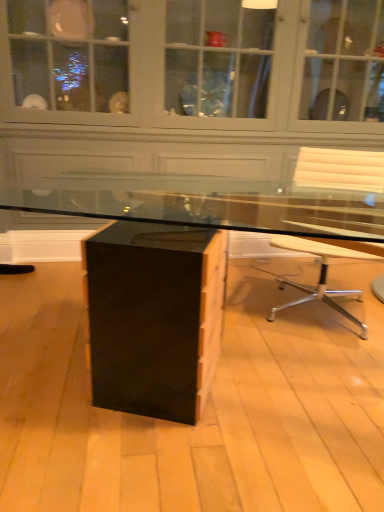
Question: Is black glossy dresser at center not inside white leather chair at right?

Choices:
 (A) yes
 (B) no

Answer: (A)

Question: Does black glossy dresser at center have a greater height compared to white leather chair at right?

Choices:
 (A) no
 (B) yes

Answer: (B)

Question: Is white leather chair at right at the back of black glossy dresser at center?

Choices:
 (A) no
 (B) yes

Answer: (B)

Question: Is black glossy dresser at center thinner than white leather chair at right?

Choices:
 (A) no
 (B) yes

Answer: (B)

Question: From a real-world perspective, is black glossy dresser at center located beneath white leather chair at right?

Choices:
 (A) no
 (B) yes

Answer: (A)

Question: Based on their positions, is black glossy dresser at center located to the left or right of white leather chair at right?

Choices:
 (A) left
 (B) right

Answer: (A)

Question: Considering the positions of point (347, 117) and point (365, 249), is point (347, 117) closer or farther from the camera than point (365, 249)?

Choices:
 (A) farther
 (B) closer

Answer: (A)

Question: Is black glossy dresser at center taller or shorter than white leather chair at right?

Choices:
 (A) tall
 (B) short

Answer: (A)

Question: In terms of width, does black glossy dresser at center look wider or thinner when compared to white leather chair at right?

Choices:
 (A) wide
 (B) thin

Answer: (B)

Question: From a real-world perspective, is black glossy dresser at center positioned above or below matte black desk at center?

Choices:
 (A) below
 (B) above

Answer: (B)

Question: Relative to matte black desk at center, is black glossy dresser at center in front or behind?

Choices:
 (A) front
 (B) behind

Answer: (B)

Question: Is point (253, 163) positioned closer to the camera than point (369, 254)?

Choices:
 (A) farther
 (B) closer

Answer: (A)

Question: Looking at their shapes, would you say black glossy dresser at center is wider or thinner than matte black desk at center?

Choices:
 (A) thin
 (B) wide

Answer: (A)

Question: Is matte black desk at center taller or shorter than black glossy dresser at center?

Choices:
 (A) short
 (B) tall

Answer: (A)

Question: Would you say matte black desk at center is to the left or to the right of black glossy dresser at center in the picture?

Choices:
 (A) left
 (B) right

Answer: (B)